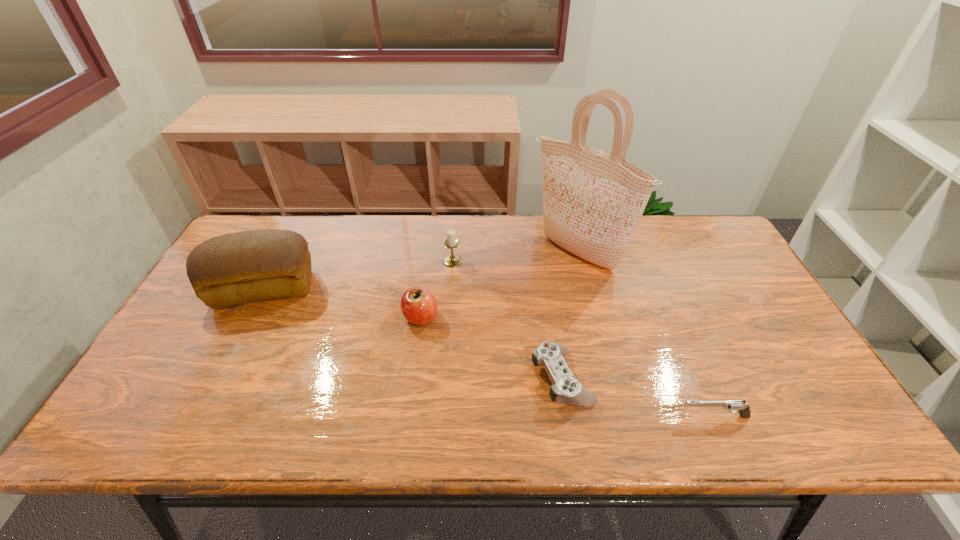
You are a GUI agent. You are given a task and a screenshot of the screen. Output one action in this format:
    pyautogui.click(x=<x>, y=<y>)
    Task: Click on the free spot between the control and the shopping bag
    
    Given the screenshot: What is the action you would take?
    pyautogui.click(x=569, y=315)

The width and height of the screenshot is (960, 540). I want to click on free space between the nearest object and the tallest object, so click(645, 335).

The width and height of the screenshot is (960, 540). I want to click on vacant space in between the pistol and the second nearest object, so click(x=637, y=397).

Image resolution: width=960 pixels, height=540 pixels. Find the location of `unoccupied area between the fifth farthest object and the tallest object`. unoccupied area between the fifth farthest object and the tallest object is located at coordinates (569, 315).

Locate which object ranks in proximity to the nearest object. Please provide its 2D coordinates. Your answer should be formatted as a tuple, i.e. [(x, y)], where the tuple contains the x and y coordinates of a point satisfying the conditions above.

[(566, 389)]

The width and height of the screenshot is (960, 540). I want to click on object identified as the closest to the control, so click(734, 406).

Image resolution: width=960 pixels, height=540 pixels. Identify the location of free space that satisfies the following two spatial constraints: 1. on the back side of the fourth shortest object; 2. on the right side of the apple. (428, 261).